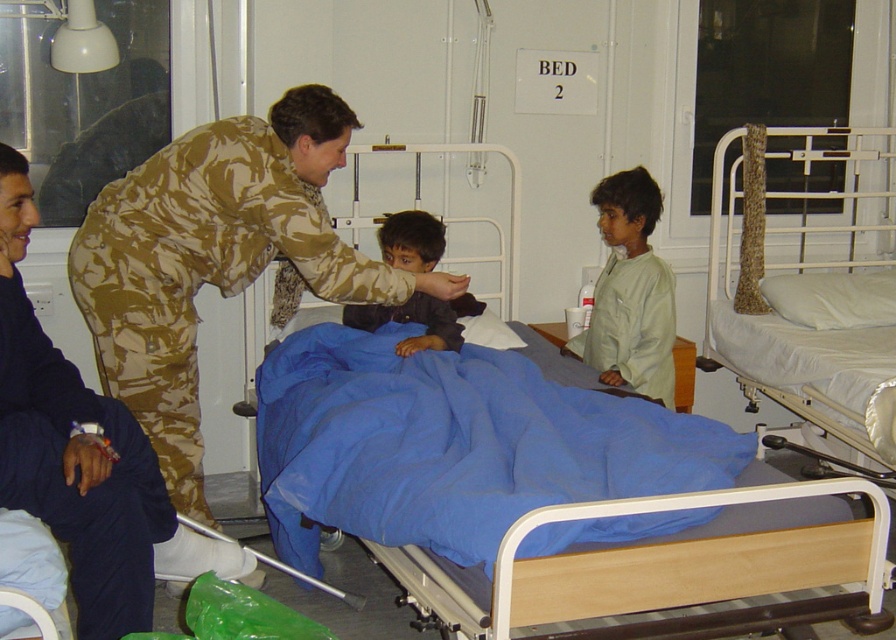
Question: Among these points, which one is nearest to the camera?

Choices:
 (A) (647, 355)
 (B) (423, 252)

Answer: (B)

Question: Which point is closer to the camera?

Choices:
 (A) (433, 260)
 (B) (479, 625)
 (C) (815, 243)
 (D) (226, 189)

Answer: (B)

Question: Which point is farther to the camera?

Choices:
 (A) light beige fabric shirt at center
 (B) dark blue fabric at center
 (C) blue fabric hospital bed at center

Answer: (A)

Question: Does blue fabric hospital bed at center appear over white fabric bed at right?

Choices:
 (A) no
 (B) yes

Answer: (A)

Question: Is white fabric bed at right below dark blue fabric at center?

Choices:
 (A) yes
 (B) no

Answer: (B)

Question: Is white fabric bed at right thinner than camouflage uniform at left?

Choices:
 (A) no
 (B) yes

Answer: (A)